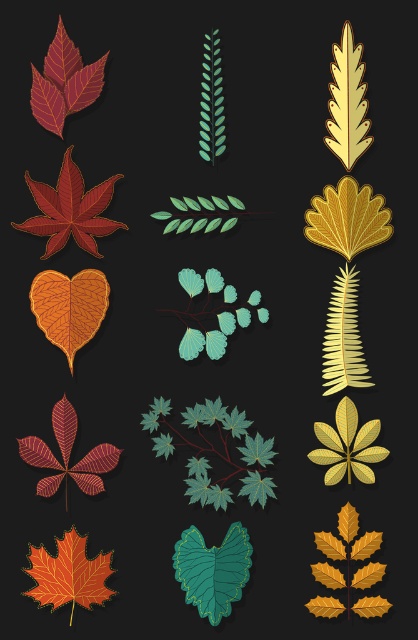
Looking at this image, is matte red maple leaf at center-left positioned at the back of matte red maple leaf at upper left?

Yes, matte red maple leaf at center-left is further from the viewer.

Where is `matte red maple leaf at center-left`? matte red maple leaf at center-left is located at coordinates (71, 209).

Which is in front, point (119, 227) or point (58, 20)?

Positioned in front is point (119, 227).

I want to click on matte red maple leaf at center-left, so click(71, 209).

In the scene shown: Is matte red maple leaf at center-left below gold metallic maple leaf at center right?

Incorrect, matte red maple leaf at center-left is not positioned below gold metallic maple leaf at center right.

Locate an element on the screen. The height and width of the screenshot is (640, 418). matte red maple leaf at center-left is located at coordinates (71, 209).

You are a GUI agent. You are given a task and a screenshot of the screen. Output one action in this format:
    pyautogui.click(x=<x>, y=<y>)
    Task: Click on the matte red maple leaf at center-left
    The height and width of the screenshot is (640, 418).
    Given the screenshot: What is the action you would take?
    pyautogui.click(x=71, y=209)

Is point (74, 346) positioned in front of point (25, 444)?

No, (74, 346) is behind (25, 444).

Which is behind, point (60, 308) or point (46, 484)?

The point (60, 308) is more distant.

The width and height of the screenshot is (418, 640). I want to click on orange matte heart-shaped leaf at center-left, so click(68, 307).